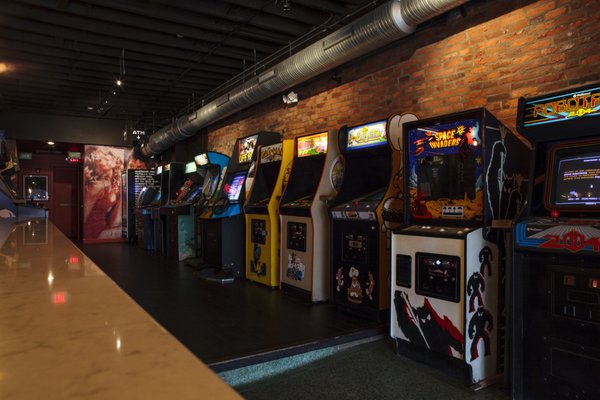
You are a GUI agent. You are given a task and a screenshot of the screen. Output one action in this format:
    pyautogui.click(x=<x>, y=<y>)
    Task: Click on the marble tabletop
    The width and height of the screenshot is (600, 400).
    Given the screenshot: What is the action you would take?
    pyautogui.click(x=127, y=319)